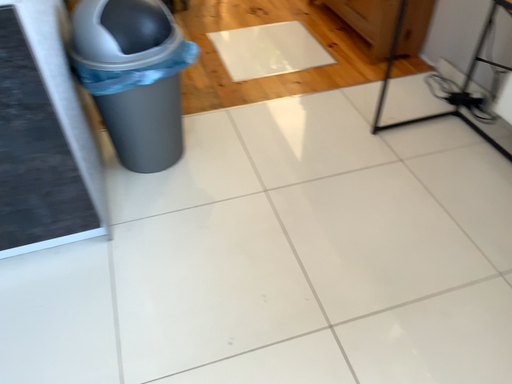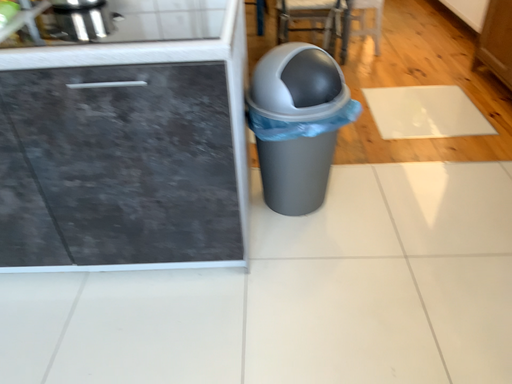
Question: How did the camera likely rotate when shooting the video?

Choices:
 (A) rotated upward
 (B) rotated downward

Answer: (A)